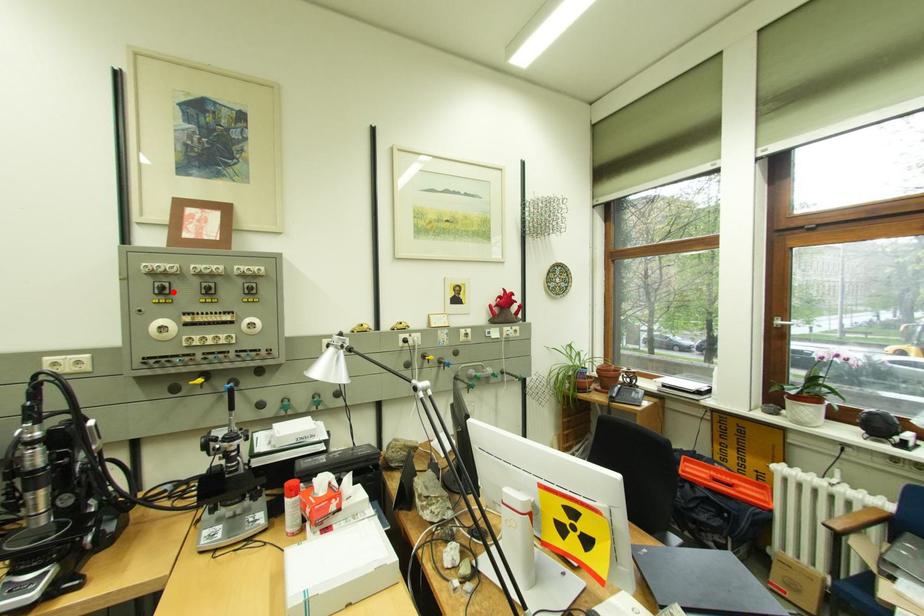
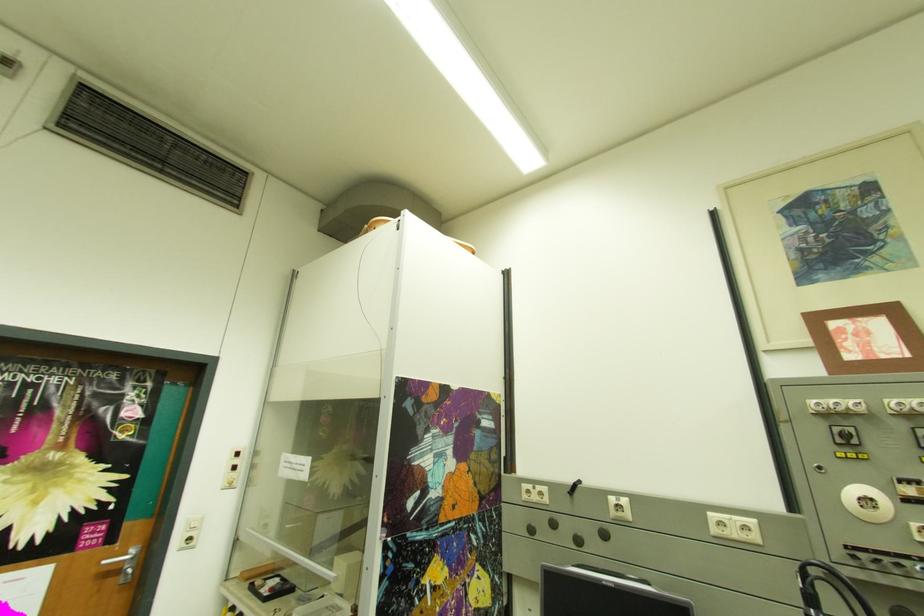
The point at the highlighted location is marked in the first image. Where is the corresponding point in the second image?

(857, 440)